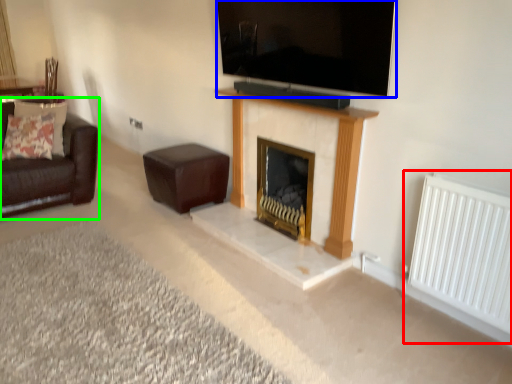
Question: Based on their relative distances, which object is farther from radiator (highlighted by a red box)? Choose from television (highlighted by a blue box) and studio couch (highlighted by a green box).

Choices:
 (A) television
 (B) studio couch

Answer: (B)